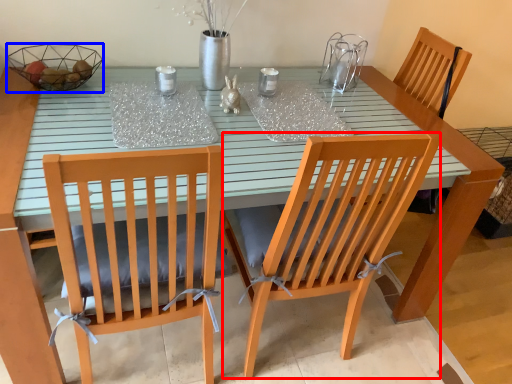
Question: Which point is further to the camera, chair (highlighted by a red box) or glass bowl (highlighted by a blue box)?

Choices:
 (A) chair
 (B) glass bowl

Answer: (B)